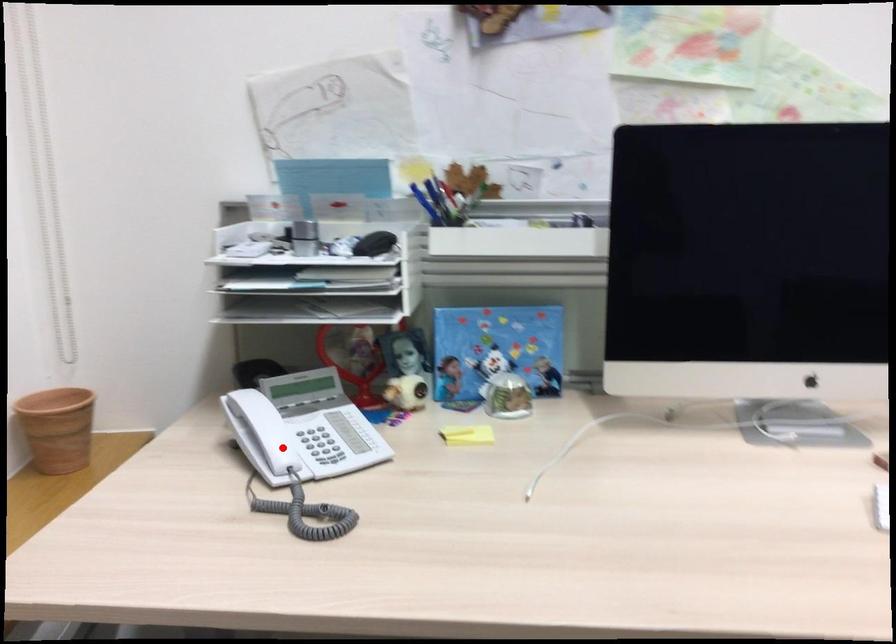
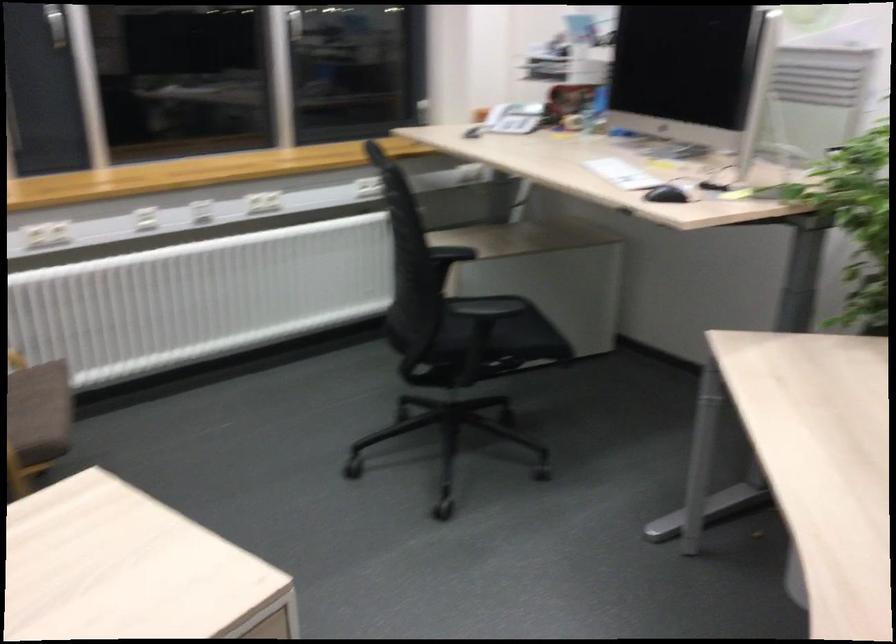
Question: I am providing you with two images of the same scene from different viewpoints. A red point is shown in image1. For the corresponding object point in image2, is it positioned nearer or farther from the camera?

Choices:
 (A) Nearer
 (B) Farther

Answer: (B)